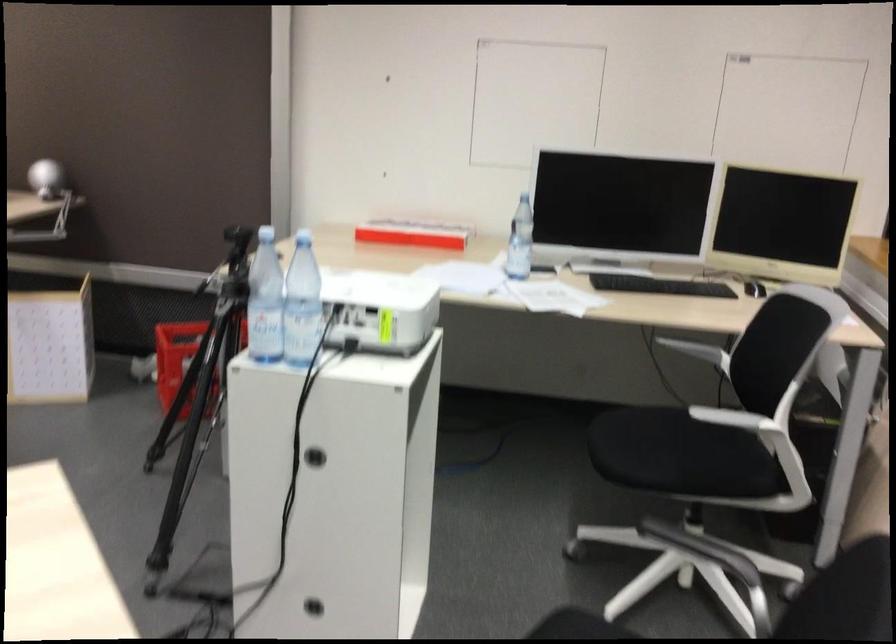
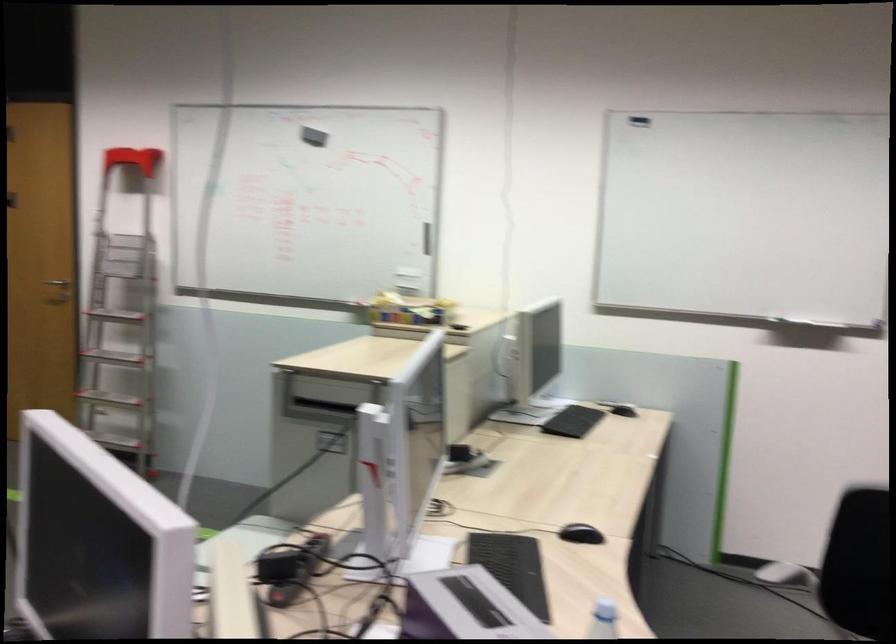
Question: The camera is either moving clockwise (left) or counter-clockwise (right) around the object. The first image is from the beginning of the video and the second image is from the end. Is the camera moving left or right when shooting the video?

Choices:
 (A) Left
 (B) Right

Answer: (B)